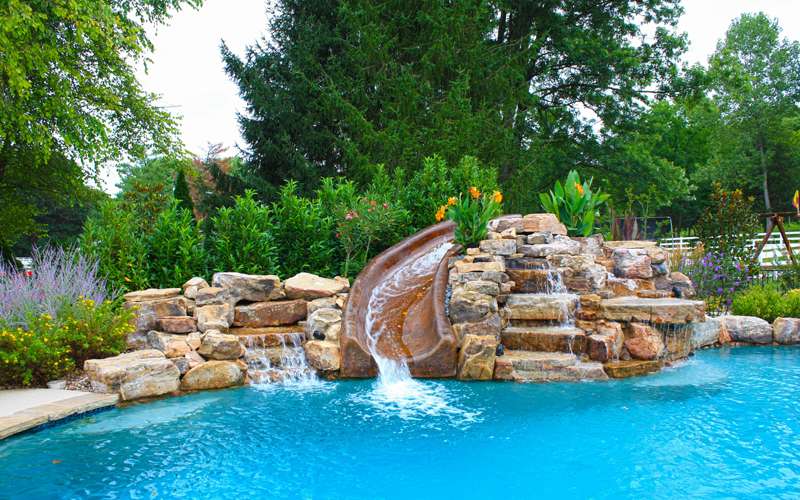
The image size is (800, 500). In order to click on smooth floor in this screenshot , I will do `click(26, 400)`.